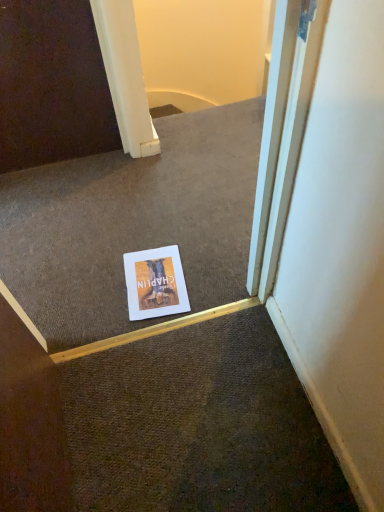
You are a GUI agent. You are given a task and a screenshot of the screen. Output one action in this format:
    pyautogui.click(x=<x>, y=<y>)
    Task: Click on the free space behind white paper at center
    
    Given the screenshot: What is the action you would take?
    pyautogui.click(x=153, y=231)